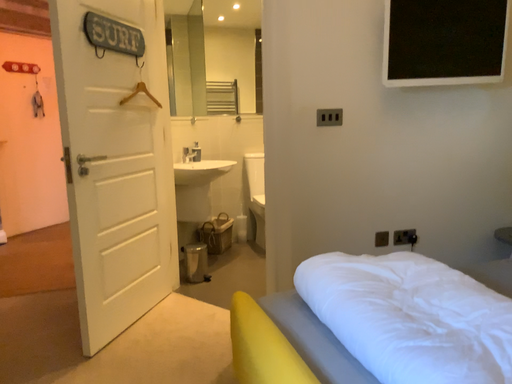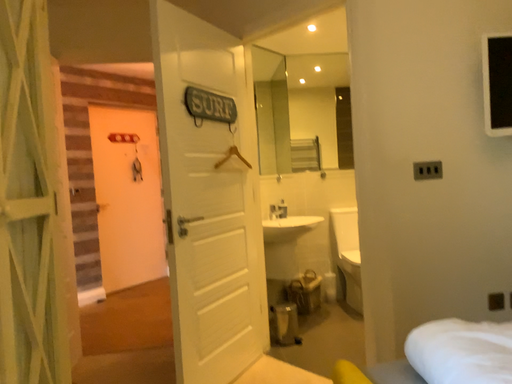
Question: How did the camera likely rotate when shooting the video?

Choices:
 (A) rotated right
 (B) rotated left

Answer: (B)